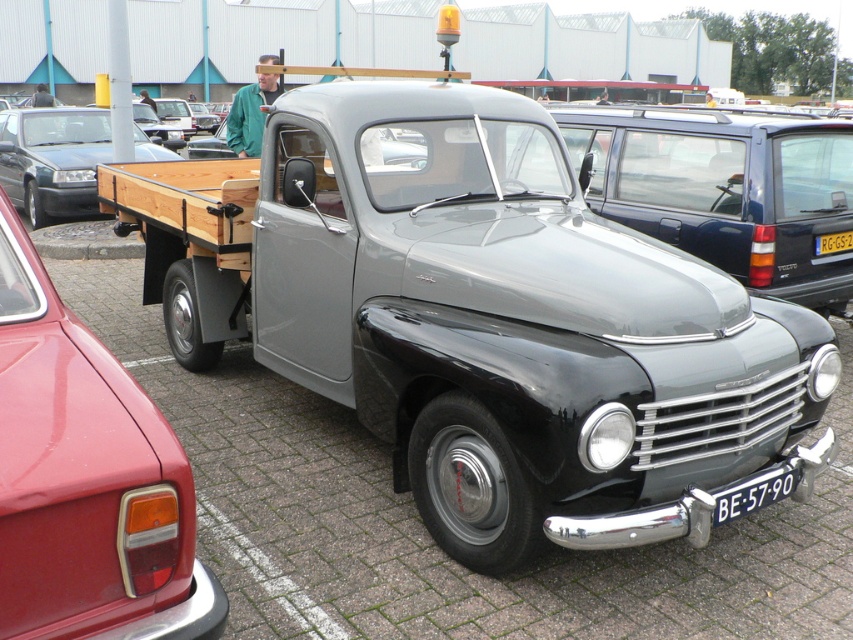
Question: Which object appears farthest from the camera in this image?

Choices:
 (A) metallic red car at lower left
 (B) green leather jacket at upper center

Answer: (B)

Question: Among these objects, which one is nearest to the camera?

Choices:
 (A) metallic red car at lower left
 (B) white plastic license plate at lower center
 (C) wooden flatbed at left

Answer: (A)

Question: Which is nearer to the yellow plastic license plate at center?

Choices:
 (A) shiny black truck at center
 (B) wooden flatbed at left
 (C) green leather jacket at upper center

Answer: (A)

Question: Observing the image, what is the correct spatial positioning of wooden flatbed at left in reference to yellow plastic license plate at center?

Choices:
 (A) right
 (B) left

Answer: (B)

Question: Can you confirm if matte gray truck at center is positioned below white plastic license plate at lower center?

Choices:
 (A) no
 (B) yes

Answer: (A)

Question: Is matte gray truck at center bigger than yellow plastic license plate at center?

Choices:
 (A) yes
 (B) no

Answer: (A)